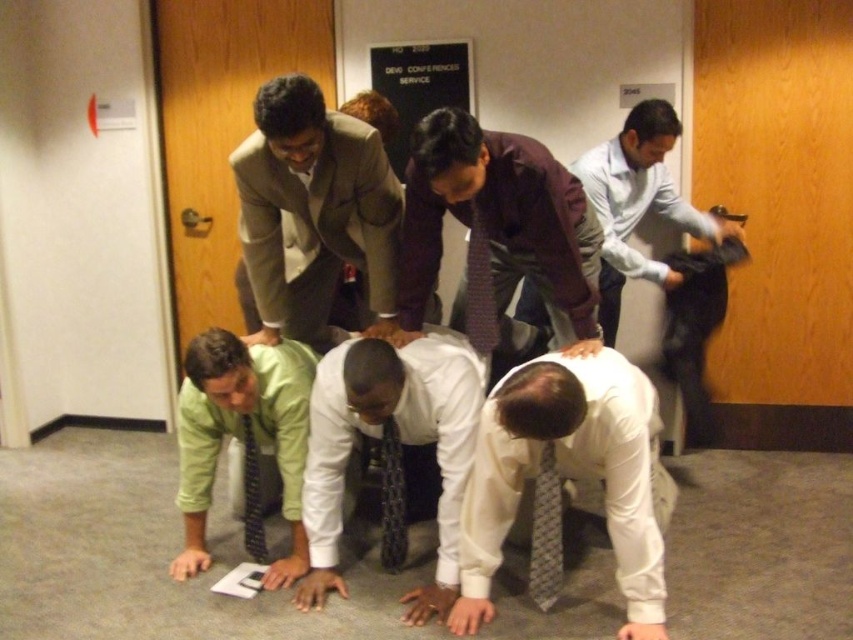
Who is more forward, [494,344] or [401,472]?

Point [401,472] is more forward.

Looking at this image, between maroon textured shirt at center and black textured tie at center, which one has less height?

Standing shorter between the two is black textured tie at center.

Between point (416, 218) and point (381, 451), which one is positioned in front?

Point (416, 218) is more forward.

Where is `maroon textured shirt at center`? This screenshot has height=640, width=853. maroon textured shirt at center is located at coordinates (498, 225).

Does green matte shirt at lower left appear on the right side of light blue shirt at right?

In fact, green matte shirt at lower left is to the left of light blue shirt at right.

Is green matte shirt at lower left above light blue shirt at right?

Incorrect, green matte shirt at lower left is not positioned above light blue shirt at right.

Which is behind, point (184, 477) or point (624, 227)?

The point (624, 227) is behind.

Find the location of `green matte shirt at lower left`. green matte shirt at lower left is located at coordinates (242, 440).

Can you confirm if black textured tie at center is positioned to the right of green fabric tie at lower center?

Yes, black textured tie at center is to the right of green fabric tie at lower center.

Can you confirm if black textured tie at center is thinner than green fabric tie at lower center?

Yes.

Is point (401, 564) positioned after point (242, 444)?

No.

The image size is (853, 640). In order to click on black textured tie at center in this screenshot , I will do `click(392, 499)`.